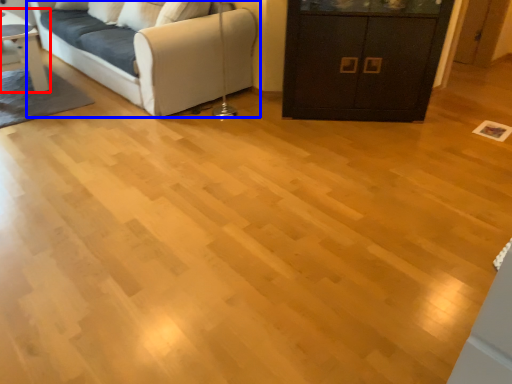
Question: Which object is closer to the camera taking this photo, table (highlighted by a red box) or studio couch (highlighted by a blue box)?

Choices:
 (A) table
 (B) studio couch

Answer: (B)